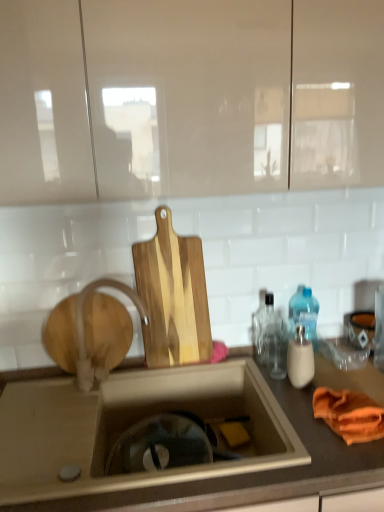
Find the location of a particular element. The height and width of the screenshot is (512, 384). free space in front of wooden at left is located at coordinates (58, 403).